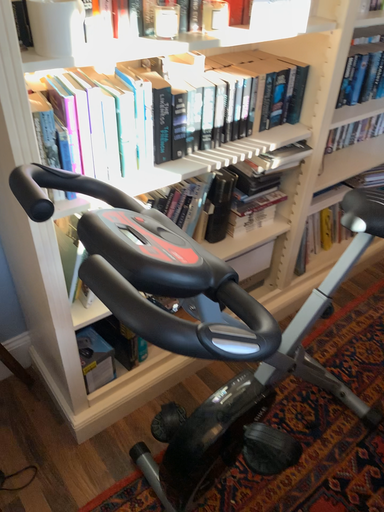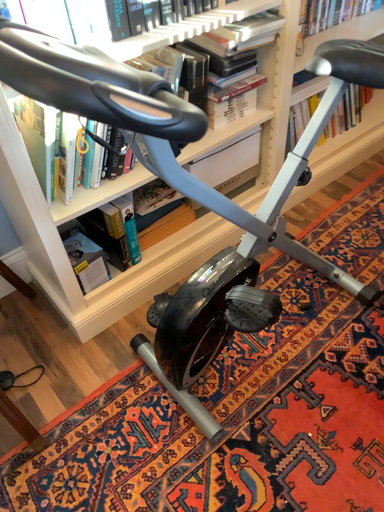
Question: How did the camera likely rotate when shooting the video?

Choices:
 (A) rotated downward
 (B) rotated upward

Answer: (A)